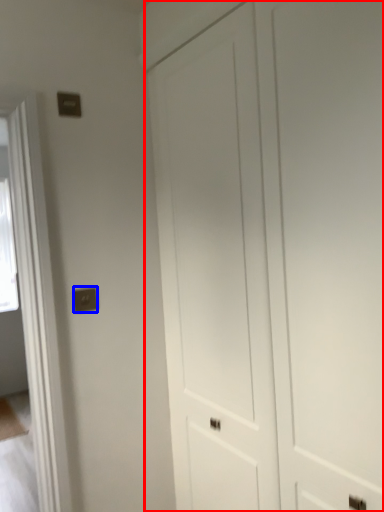
Question: Among these objects, which one is farthest to the camera, door (highlighted by a red box) or electric outlet (highlighted by a blue box)?

Choices:
 (A) door
 (B) electric outlet

Answer: (B)